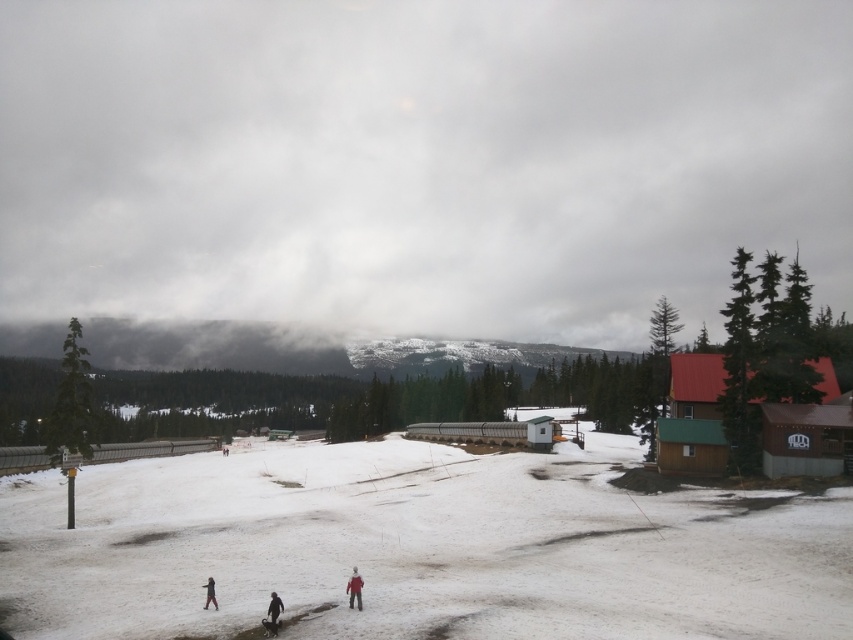
You are standing at point A located at coordinates point A at (x=349, y=586). You need to reach point B which is 102.57 feet away. Given the snowy terrain and the presence of a wooden fence and a shed with a green roof nearby, is there a direct path from point A to point B without crossing any obstacles?

The points are 102.57 feet apart, and there is a wooden fence and a shed with a green roof nearby. However, the description does not specify the exact location of these obstacles relative to the path between the points. Therefore, it is unclear if there is a direct path without crossing obstacles.

You are a photographer trying to capture both the red woolen jacket at lower center and the dark red jacket at lower center in a single frame. Given their sizes, which jacket will appear larger in your photo?

The red woolen jacket at lower center will appear larger in the photo because it is much taller than the dark red jacket at lower center.

You are standing at the center of the snowy landscape and notice a dark gray fabric jacket at lower center. Based on its position, can you estimate whether it is closer to you or further away compared to the wooden fence in the midground?

The dark gray fabric jacket at lower center is located at point (273,612), which places it closer to the viewer than the wooden fence in the midground. Therefore, the jacket is nearer to you than the wooden fence.